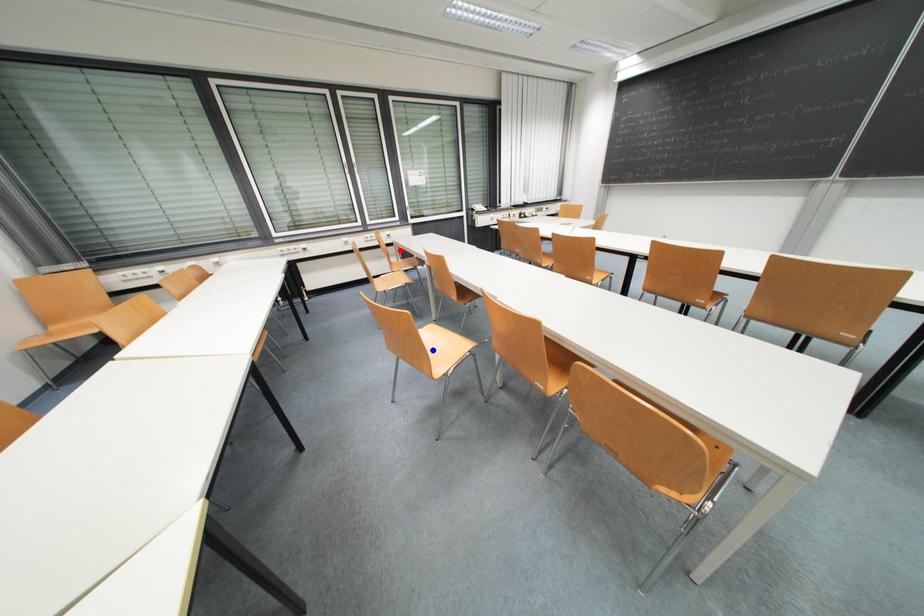
Question: In the image, two points are highlighted. Which point is nearer to the camera? Reply with the corresponding letter.

Choices:
 (A) blue point
 (B) red point

Answer: (A)